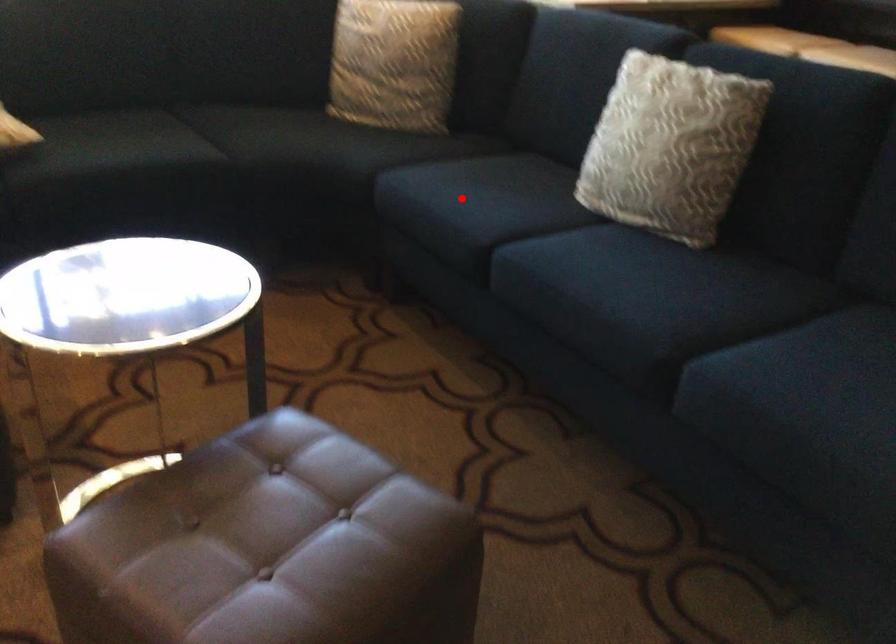
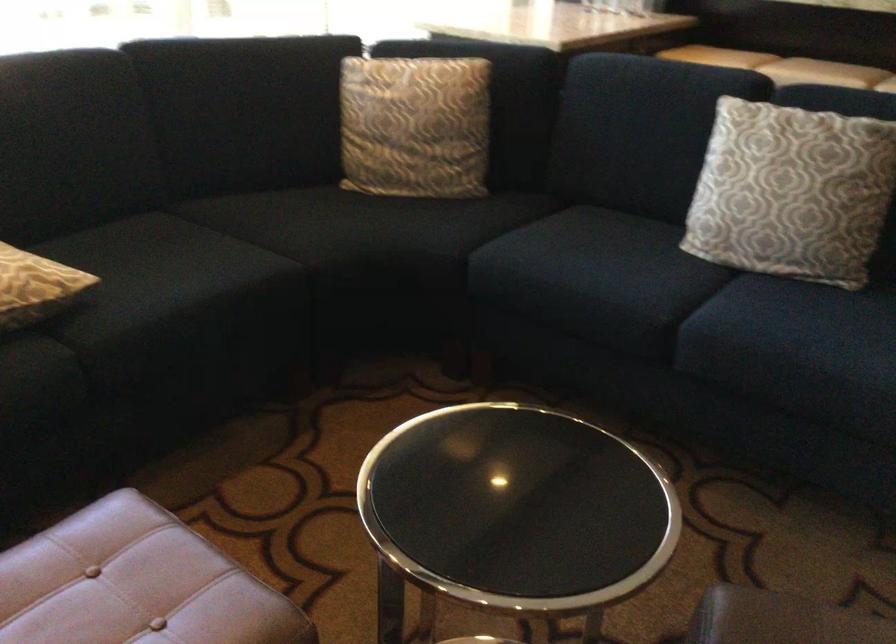
In the second image, find the point that corresponds to the highlighted location in the first image.

(590, 274)